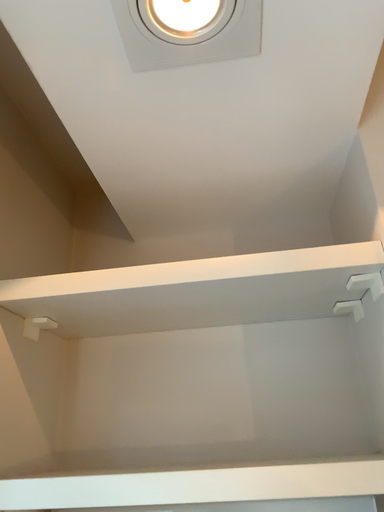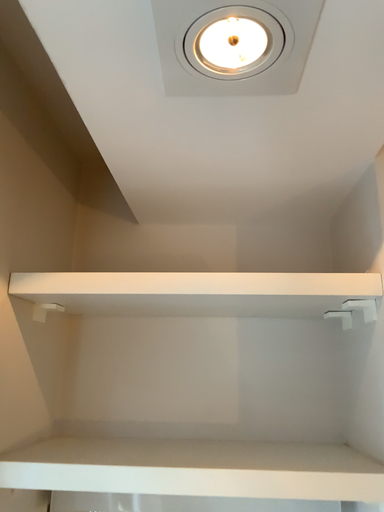
Question: Which way did the camera rotate in the video?

Choices:
 (A) rotated downward
 (B) rotated upward

Answer: (A)